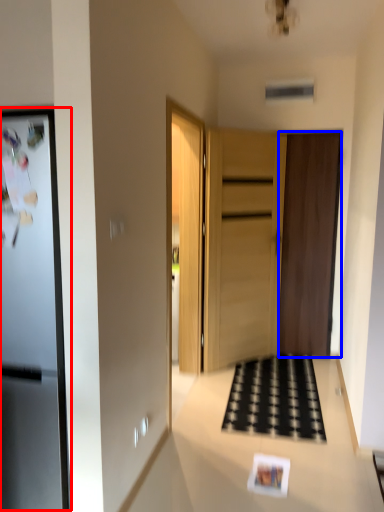
Question: Which of the following is the farthest to the observer, fridge (highlighted by a red box) or door (highlighted by a blue box)?

Choices:
 (A) fridge
 (B) door

Answer: (B)